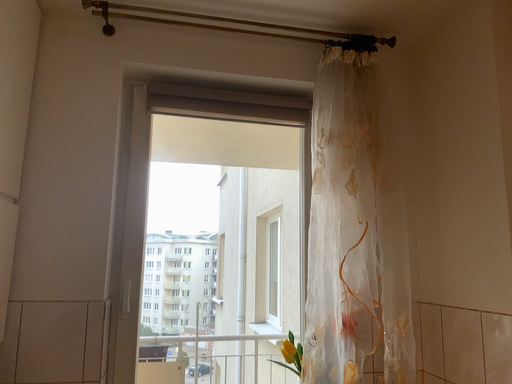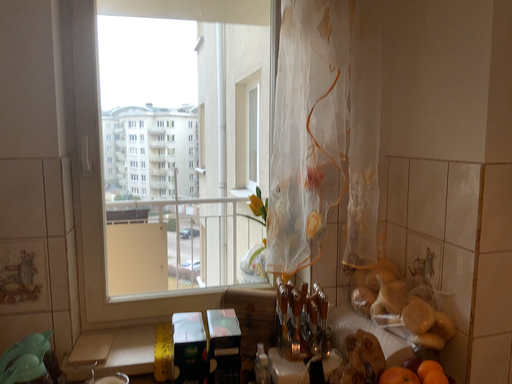
Question: Which way did the camera rotate in the video?

Choices:
 (A) rotated upward
 (B) rotated downward

Answer: (B)